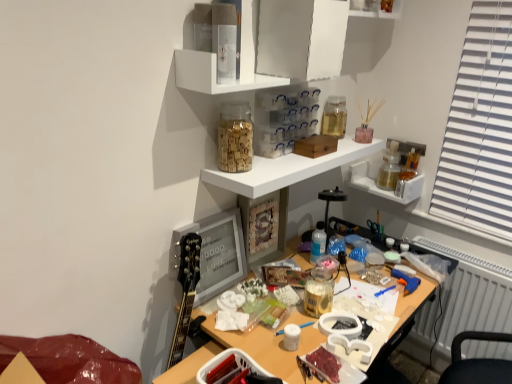
The width and height of the screenshot is (512, 384). Find the location of `metallic gold jar at upper right, arranged as the first shelf when ordered from the bottom`. metallic gold jar at upper right, arranged as the first shelf when ordered from the bottom is located at coordinates (379, 186).

Identify the location of white matte jar at center, the first stationery from the front. (291, 337).

Describe the element at coordinates (306, 324) in the screenshot. I see `blue plastic paint brush at center` at that location.

Describe the element at coordinates (234, 137) in the screenshot. This screenshot has width=512, height=384. I see `wooden alphabet blocks at upper center, which is counted as the second stationery, starting from the back` at that location.

Describe the element at coordinates (334, 117) in the screenshot. The width and height of the screenshot is (512, 384). I see `translucent glass jar at upper center, positioned as the third stationery in bottom-to-top order` at that location.

What do you see at coordinates (470, 295) in the screenshot?
I see `white plastic radiator at lower right` at bounding box center [470, 295].

Identify the location of metallic gold jar at upper right, arranged as the first shelf when ordered from the bottom. The width and height of the screenshot is (512, 384). (379, 186).

Are transparent glass jar at upper center, the fourth shelf ordered from the bottom, and white plastic radiator at lower right located far from each other?

That's right, there is a large distance between transparent glass jar at upper center, the fourth shelf ordered from the bottom, and white plastic radiator at lower right.

How many degrees apart are the facing directions of transparent glass jar at upper center, the fourth shelf ordered from the bottom, and white plastic radiator at lower right?

90.9 degrees.

Is transparent glass jar at upper center, positioned as the first shelf in top-to-bottom order, aimed at white plastic radiator at lower right?

No, transparent glass jar at upper center, positioned as the first shelf in top-to-bottom order, does not turn towards white plastic radiator at lower right.

Between transparent glass jar at upper center, positioned as the first shelf in top-to-bottom order, and white plastic radiator at lower right, which one has more height?

Standing taller between the two is white plastic radiator at lower right.

From their relative heights in the image, would you say blue plastic paint brush at center is taller or shorter than metallic gold jar at upper right, the 4th shelf in the top-to-bottom sequence?

blue plastic paint brush at center is shorter than metallic gold jar at upper right, the 4th shelf in the top-to-bottom sequence.

From the image's perspective, is blue plastic paint brush at center beneath metallic gold jar at upper right, the 4th shelf in the top-to-bottom sequence?

Yes, from the image's perspective, blue plastic paint brush at center is below metallic gold jar at upper right, the 4th shelf in the top-to-bottom sequence.

Is blue plastic paint brush at center in front of metallic gold jar at upper right, the 4th shelf in the top-to-bottom sequence?

Yes, the depth of blue plastic paint brush at center is less than that of metallic gold jar at upper right, the 4th shelf in the top-to-bottom sequence.

Is blue plastic paint brush at center far from metallic gold jar at upper right, the 4th shelf in the top-to-bottom sequence?

No, there isn't a large distance between blue plastic paint brush at center and metallic gold jar at upper right, the 4th shelf in the top-to-bottom sequence.

Is blue plastic paint brush at center inside or outside of white matte jar at center, the first stationery from the front?

blue plastic paint brush at center cannot be found inside white matte jar at center, the first stationery from the front.

Considering the relative sizes of blue plastic paint brush at center and white matte jar at center, the 2th stationery from the left, in the image provided, is blue plastic paint brush at center thinner than white matte jar at center, the 2th stationery from the left,?

Yes.

Consider the image. Can you confirm if blue plastic paint brush at center is bigger than white matte jar at center, the 2th stationery from the left?

No.

Is blue plastic paint brush at center further to camera compared to white matte jar at center, which is counted as the 3th stationery, starting from the back?

Yes, blue plastic paint brush at center is further from the viewer.

From the image's perspective, which one is positioned lower, translucent glass jar at upper center, acting as the third stationery starting from the left, or white glossy shelf at upper center, the third shelf from the bottom?

translucent glass jar at upper center, acting as the third stationery starting from the left, from the image's perspective.

Which shelf is the 2nd one when counting from the left side of the translucent glass jar at upper center, the 1th stationery in the back-to-front sequence? Please provide its 2D coordinates.

[(215, 75)]

Is translucent glass jar at upper center, acting as the third stationery starting from the left, not close to white glossy shelf at upper center, placed as the 2th shelf when sorted from top to bottom?

No, translucent glass jar at upper center, acting as the third stationery starting from the left, is not far from white glossy shelf at upper center, placed as the 2th shelf when sorted from top to bottom.

Considering the relative sizes of white matte jar at center, the 2th stationery from the left, and blue plastic paint brush at center in the image provided, is white matte jar at center, the 2th stationery from the left, shorter than blue plastic paint brush at center?

In fact, white matte jar at center, the 2th stationery from the left, may be taller than blue plastic paint brush at center.

Consider the image. From the image's perspective, is white matte jar at center, acting as the 2th stationery starting from the right, above blue plastic paint brush at center?

Incorrect, from the image's perspective, white matte jar at center, acting as the 2th stationery starting from the right, is lower than blue plastic paint brush at center.

Are white matte jar at center, which is counted as the 3th stationery, starting from the back, and blue plastic paint brush at center located far from each other?

white matte jar at center, which is counted as the 3th stationery, starting from the back, is actually quite close to blue plastic paint brush at center.

Based on the photo, which object is further away from the camera, white matte jar at center, which is counted as the 3th stationery, starting from the back, or blue plastic paint brush at center?

blue plastic paint brush at center is more distant.

Which point is more forward, (x=223, y=162) or (x=286, y=342)?

The point (x=286, y=342) is in front.

Measure the distance from wooden alphabet blocks at upper center, positioned as the second stationery in bottom-to-top order, to white matte jar at center, arranged as the 3th stationery when viewed from the top.

They are 61.02 centimeters apart.

Who is smaller, wooden alphabet blocks at upper center, arranged as the first stationery when viewed from the left, or white matte jar at center, which is counted as the 3th stationery, starting from the back?

With smaller size is white matte jar at center, which is counted as the 3th stationery, starting from the back.

In the scene shown: Considering the sizes of objects wooden alphabet blocks at upper center, which is counted as the second stationery, starting from the back, and white matte jar at center, the first stationery from the front, in the image provided, who is shorter, wooden alphabet blocks at upper center, which is counted as the second stationery, starting from the back, or white matte jar at center, the first stationery from the front,?

white matte jar at center, the first stationery from the front, is shorter.

Is translucent glass jar at upper center, the third shelf in the top-to-bottom sequence, far from wooden alphabet blocks at upper center, which appears as the second stationery when viewed from the top?

That's not correct — translucent glass jar at upper center, the third shelf in the top-to-bottom sequence, is a little close to wooden alphabet blocks at upper center, which appears as the second stationery when viewed from the top.

Does translucent glass jar at upper center, the third shelf in the top-to-bottom sequence, lie in front of wooden alphabet blocks at upper center, positioned as the second stationery in bottom-to-top order?

That is True.

Is translucent glass jar at upper center, the second shelf ordered from the bottom, taller or shorter than wooden alphabet blocks at upper center, which is counted as the second stationery, starting from the back?

Considering their sizes, translucent glass jar at upper center, the second shelf ordered from the bottom, has less height than wooden alphabet blocks at upper center, which is counted as the second stationery, starting from the back.

The height and width of the screenshot is (384, 512). In order to click on shelf that is the 1st object located in front of the white plastic radiator at lower right in this screenshot , I will do pos(374,10).

Find the location of a particular element. paint brush that appears below the metallic gold jar at upper right, the 4th shelf in the top-to-bottom sequence (from a real-world perspective) is located at coordinates (306, 324).

Which object lies further to the anchor point white matte jar at center, acting as the 2th stationery starting from the right, transparent glass jar at upper center, positioned as the first shelf in top-to-bottom order, or translucent glass jar at upper center, arranged as the 3th stationery when viewed from the front?

transparent glass jar at upper center, positioned as the first shelf in top-to-bottom order, is positioned further to the anchor white matte jar at center, acting as the 2th stationery starting from the right.

Estimate the real-world distances between objects in this image. Which object is further from blue plastic paint brush at center, metallic gold jar at upper right, the 4th shelf in the top-to-bottom sequence, or translucent glass jar at upper center, positioned as the third stationery in bottom-to-top order?

Among the two, metallic gold jar at upper right, the 4th shelf in the top-to-bottom sequence, is located further to blue plastic paint brush at center.

Looking at the image, which one is located closer to transparent glass jar at upper center, positioned as the first shelf in top-to-bottom order, wooden alphabet blocks at upper center, which is counted as the second stationery, starting from the back, or metallic gold jar at upper right, arranged as the first shelf when ordered from the bottom?

The object closer to transparent glass jar at upper center, positioned as the first shelf in top-to-bottom order, is metallic gold jar at upper right, arranged as the first shelf when ordered from the bottom.

Which object lies further to the anchor point blue plastic paint brush at center, white matte jar at center, acting as the 2th stationery starting from the right, or transparent glass jar at upper center, positioned as the first shelf in top-to-bottom order?

transparent glass jar at upper center, positioned as the first shelf in top-to-bottom order, lies further to blue plastic paint brush at center than the other object.

In the scene shown: Estimate the real-world distances between objects in this image. Which object is further from wooden alphabet blocks at upper center, acting as the third stationery starting from the right, transparent glass jar at upper center, the fourth shelf ordered from the bottom, or translucent glass jar at upper center, the 1th stationery in the back-to-front sequence?

transparent glass jar at upper center, the fourth shelf ordered from the bottom, is further to wooden alphabet blocks at upper center, acting as the third stationery starting from the right.

Considering their positions, is white plastic radiator at lower right positioned closer to transparent glass jar at upper center, positioned as the first shelf in top-to-bottom order, than wooden alphabet blocks at upper center, which is counted as the second stationery, starting from the back?

wooden alphabet blocks at upper center, which is counted as the second stationery, starting from the back, lies closer to transparent glass jar at upper center, positioned as the first shelf in top-to-bottom order, than the other object.

Looking at this image, when comparing their distances from white glossy shelf at upper center, the third shelf from the bottom, does translucent glass jar at upper center, the 1th stationery positioned from the right, or blue plastic paint brush at center seem further?

blue plastic paint brush at center is positioned further to the anchor white glossy shelf at upper center, the third shelf from the bottom.

In the scene shown: Estimate the real-world distances between objects in this image. Which object is closer to transparent glass jar at upper center, positioned as the first shelf in top-to-bottom order, wooden alphabet blocks at upper center, positioned as the second stationery in bottom-to-top order, or translucent glass jar at upper center, the second shelf ordered from the bottom?

Based on the image, translucent glass jar at upper center, the second shelf ordered from the bottom, appears to be nearer to transparent glass jar at upper center, positioned as the first shelf in top-to-bottom order.

Where is `bottle between translucent glass jar at upper center, the third shelf in the top-to-bottom sequence, and white plastic radiator at lower right, in the horizontal direction`? Image resolution: width=512 pixels, height=384 pixels. bottle between translucent glass jar at upper center, the third shelf in the top-to-bottom sequence, and white plastic radiator at lower right, in the horizontal direction is located at coordinates (318, 242).

Find the location of a particular element. This screenshot has height=384, width=512. paint brush between wooden alphabet blocks at upper center, arranged as the first stationery when viewed from the left, and white plastic radiator at lower right is located at coordinates (306, 324).

The image size is (512, 384). Identify the location of bottle located between translucent glass jar at upper center, the third shelf in the top-to-bottom sequence, and metallic gold jar at upper right, the 4th shelf in the top-to-bottom sequence, in the depth direction. (318, 242).

Locate an element on the screen. bottle between transparent glass jar at upper center, positioned as the first shelf in top-to-bottom order, and white matte jar at center, the first stationery from the front, vertically is located at coordinates (318, 242).